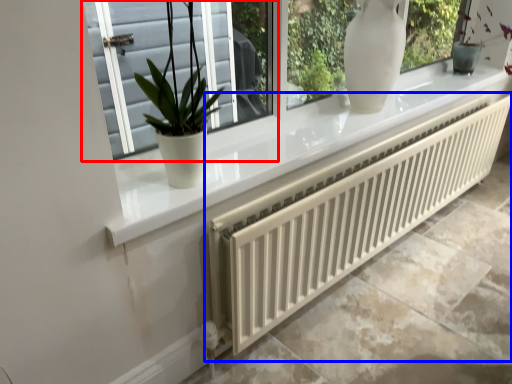
Question: Among these objects, which one is nearest to the camera, window (highlighted by a red box) or radiator (highlighted by a blue box)?

Choices:
 (A) window
 (B) radiator

Answer: (A)